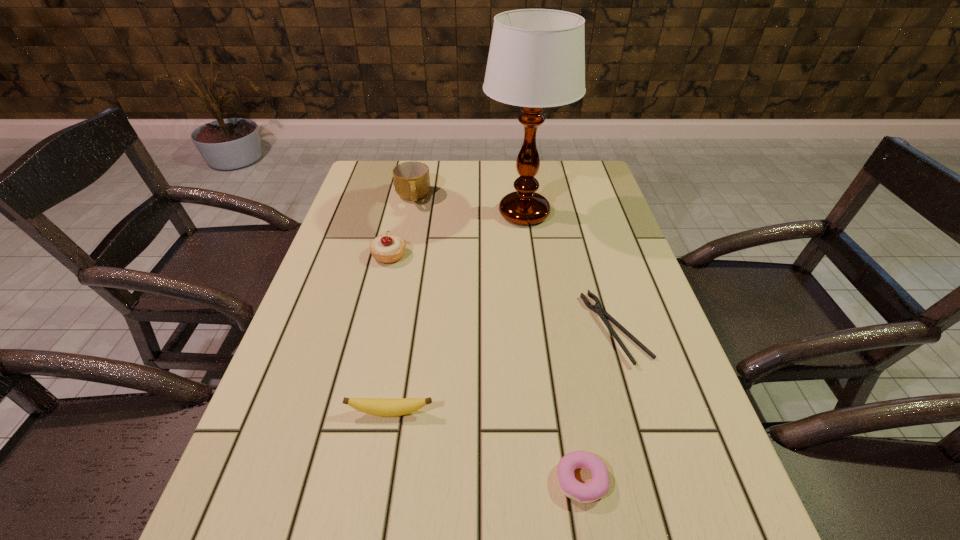
The width and height of the screenshot is (960, 540). Find the location of `object that is the fourth closest to the right pastry`. object that is the fourth closest to the right pastry is located at coordinates (536, 59).

I want to click on object identified as the fourth closest to the mug, so click(381, 407).

Identify the location of vacant space that satisfies the following two spatial constraints: 1. on the side with the handle of the third shortest object; 2. on the left side of the fifth shortest object. This screenshot has width=960, height=540. (368, 413).

The image size is (960, 540). I want to click on vacant space that satisfies the following two spatial constraints: 1. on the side with the handle of the fifth shortest object; 2. on the left side of the right pastry, so click(353, 481).

I want to click on vacant space that satisfies the following two spatial constraints: 1. on the front side of the taller pastry; 2. on the left side of the shortest object, so click(x=372, y=329).

Identify the location of free region that satisfies the following two spatial constraints: 1. on the back side of the tallest object; 2. on the right side of the second nearest object. (423, 213).

Identify the location of vacant space that satisfies the following two spatial constraints: 1. on the side with the handle of the fifth shortest object; 2. on the left side of the table lamp. (410, 213).